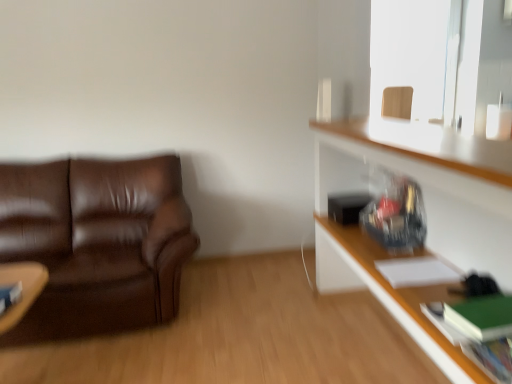
Question: From the image's perspective, is wooden frame at upper right below white paper at upper right, the 2th book viewed from the left?

Choices:
 (A) no
 (B) yes

Answer: (A)

Question: Is wooden frame at upper right facing towards white paper at upper right, acting as the third book starting from the right?

Choices:
 (A) no
 (B) yes

Answer: (B)

Question: Is wooden frame at upper right at the right side of white paper at upper right, the 2th book viewed from the left?

Choices:
 (A) yes
 (B) no

Answer: (A)

Question: Is wooden frame at upper right not inside white paper at upper right, acting as the third book starting from the right?

Choices:
 (A) yes
 (B) no

Answer: (A)

Question: Considering the relative sizes of wooden frame at upper right and white paper at upper right, which is counted as the 1th book, starting from the back, in the image provided, is wooden frame at upper right wider than white paper at upper right, which is counted as the 1th book, starting from the back,?

Choices:
 (A) yes
 (B) no

Answer: (B)

Question: From the image's perspective, is hardcover book at lower left, which is the second book from back to front, positioned above or below wooden swivel chair at upper right?

Choices:
 (A) above
 (B) below

Answer: (B)

Question: From a real-world perspective, is hardcover book at lower left, the fourth book from the right, physically located above or below wooden swivel chair at upper right?

Choices:
 (A) above
 (B) below

Answer: (B)

Question: Considering the positions of hardcover book at lower left, which is the second book from back to front, and wooden swivel chair at upper right in the image, is hardcover book at lower left, which is the second book from back to front, taller or shorter than wooden swivel chair at upper right?

Choices:
 (A) short
 (B) tall

Answer: (A)

Question: In terms of width, does hardcover book at lower left, the 1th book from the left, look wider or thinner when compared to wooden swivel chair at upper right?

Choices:
 (A) thin
 (B) wide

Answer: (B)

Question: In terms of height, does hardcover book at lower left, the 1th book from the left, look taller or shorter compared to hardcover book at lower right, the 1th book viewed from the right?

Choices:
 (A) short
 (B) tall

Answer: (B)

Question: Does point (14, 288) appear closer or farther from the camera than point (499, 344)?

Choices:
 (A) closer
 (B) farther

Answer: (B)

Question: Is hardcover book at lower left, which is the third book in front-to-back order, in front of or behind hardcover book at lower right, the 1th book viewed from the right, in the image?

Choices:
 (A) front
 (B) behind

Answer: (B)

Question: From a real-world perspective, relative to hardcover book at lower right, positioned as the 4th book in left-to-right order, is hardcover book at lower left, which is the third book in front-to-back order, vertically above or below?

Choices:
 (A) above
 (B) below

Answer: (A)

Question: Is hardcover book at lower right, the 1th book viewed from the right, bigger or smaller than green matte book at lower right, which appears as the 3th book when viewed from the left?

Choices:
 (A) big
 (B) small

Answer: (A)

Question: In the image, is hardcover book at lower right, placed as the 1th book when sorted from front to back, positioned in front of or behind green matte book at lower right, which is counted as the 3th book, starting from the back?

Choices:
 (A) front
 (B) behind

Answer: (A)